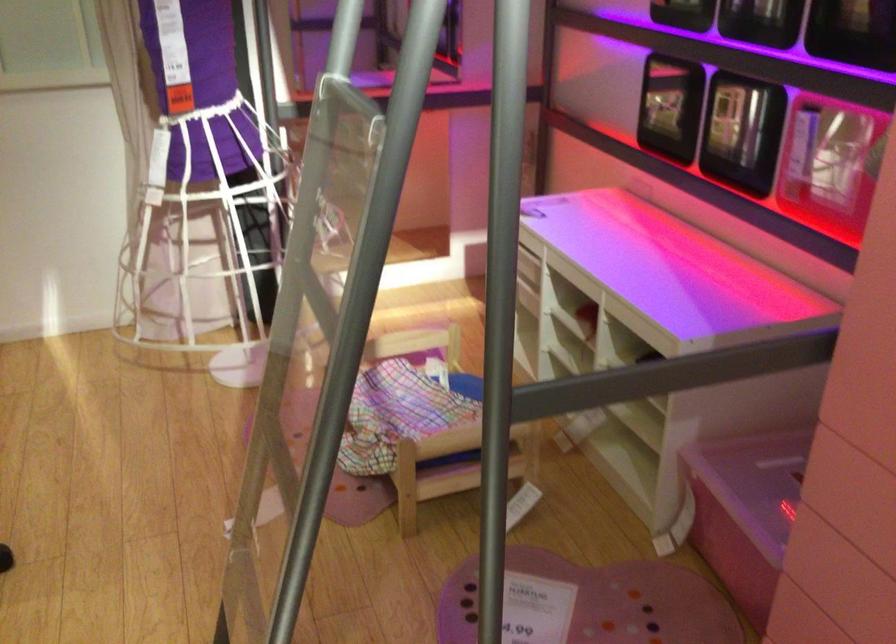
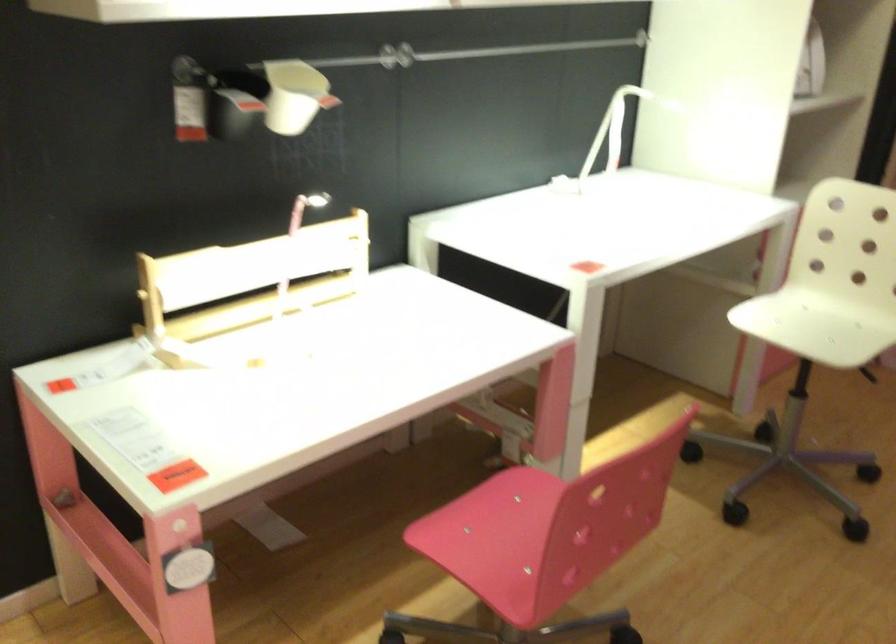
Question: Based on the continuous images, in which direction is the camera rotating? Reply with the corresponding letter.

Choices:
 (A) Left
 (B) Right
 (C) Up
 (D) Down

Answer: (A)